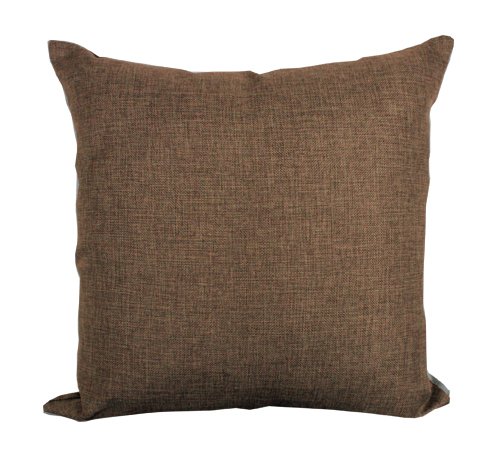
Locate an element on the screen. pillow is located at coordinates (282, 247).